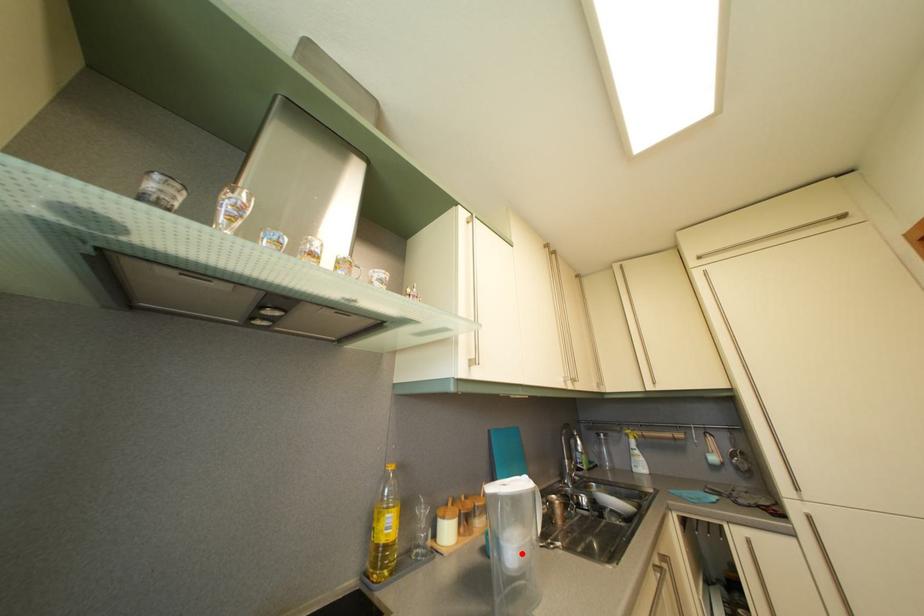
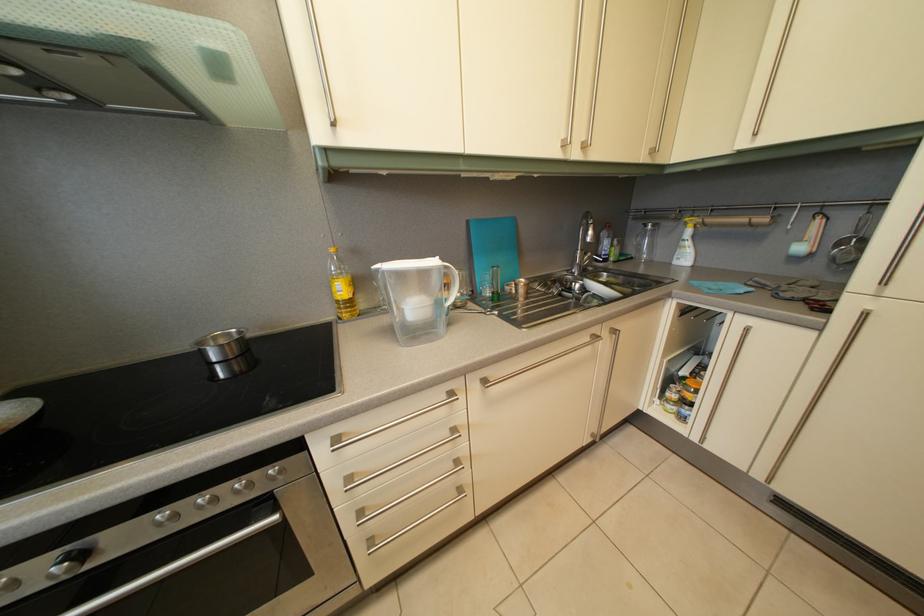
Question: I am providing you with two images of the same scene from different viewpoints. Image1 has a red point marked. In image2, the corresponding 3D location appears at what relative position? Reply with the corresponding letter.

Choices:
 (A) Closer
 (B) Farther

Answer: (A)